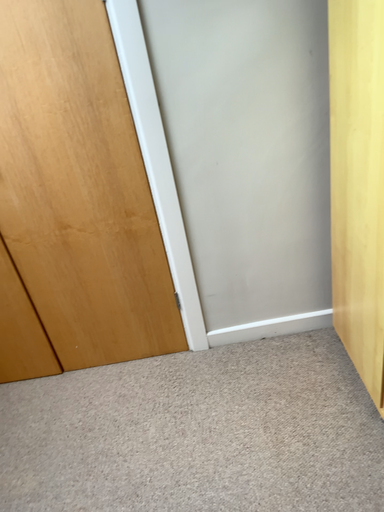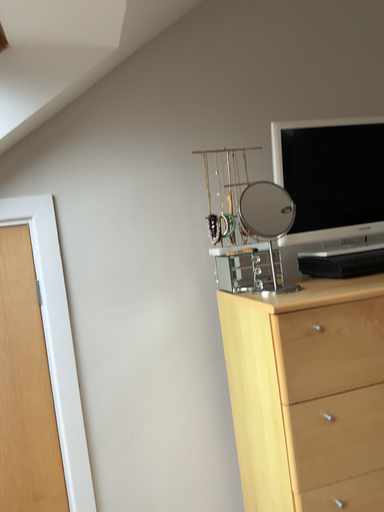
Question: How did the camera likely rotate when shooting the video?

Choices:
 (A) rotated right
 (B) rotated left

Answer: (A)